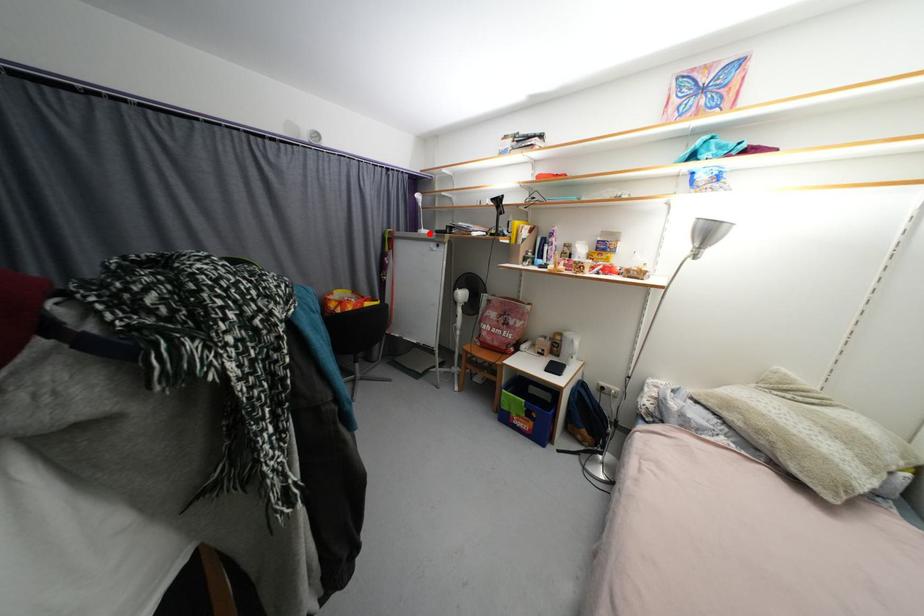
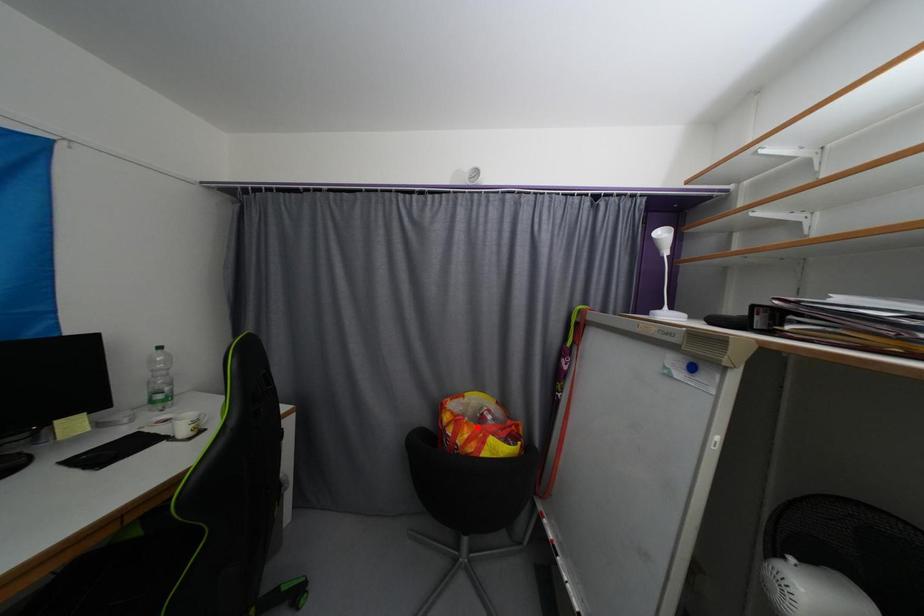
I am providing you with two images of the same scene from different viewpoints. A red point is marked on the first image and another point is marked on the second image. Do the highlighted points in image1 and image2 indicate the same real-world spot?

No